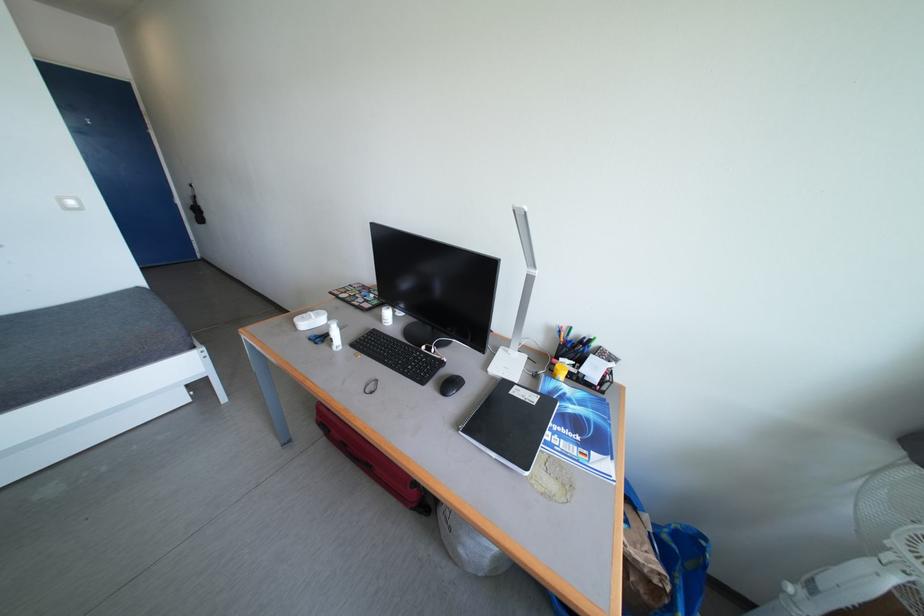
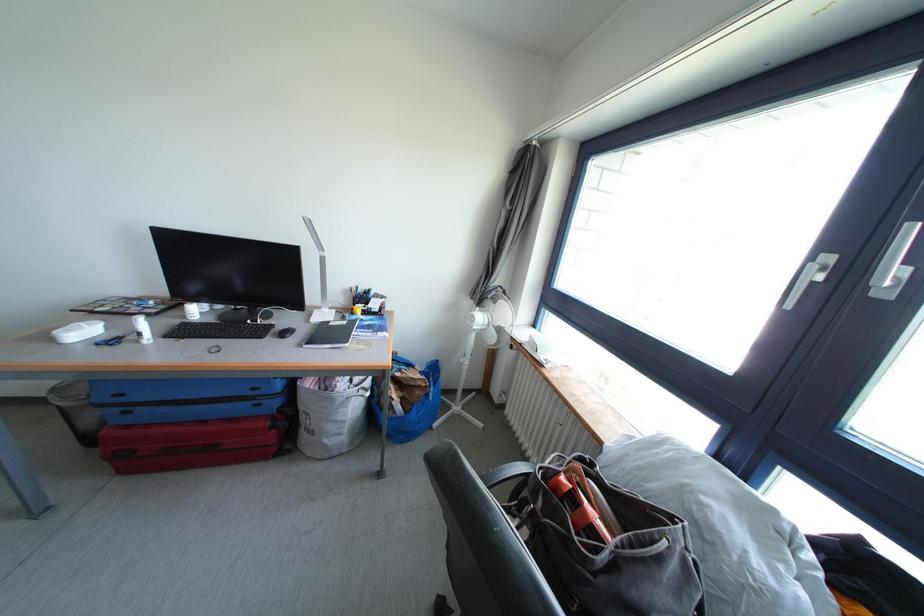
The point at (448, 368) is marked in the first image. Where is the corresponding point in the second image?

(278, 331)